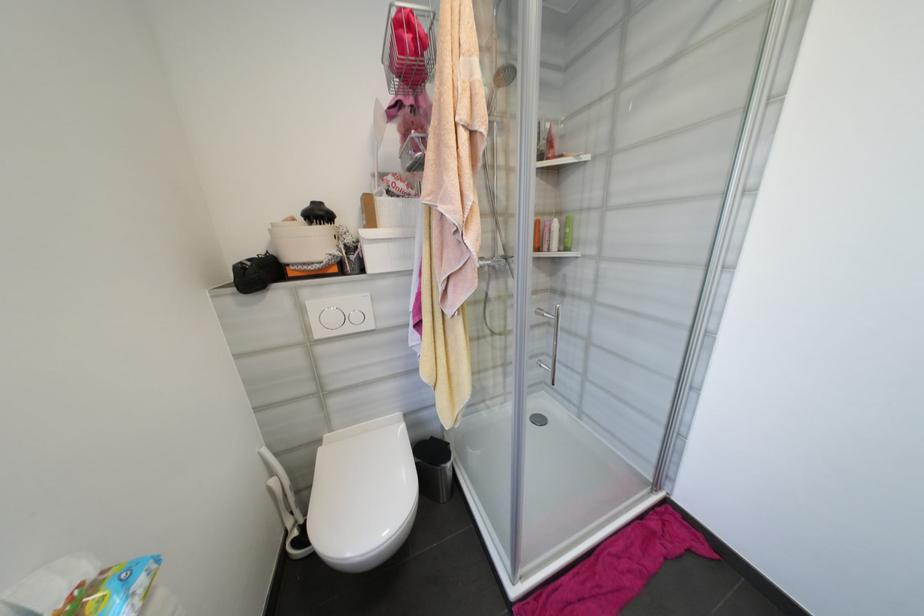
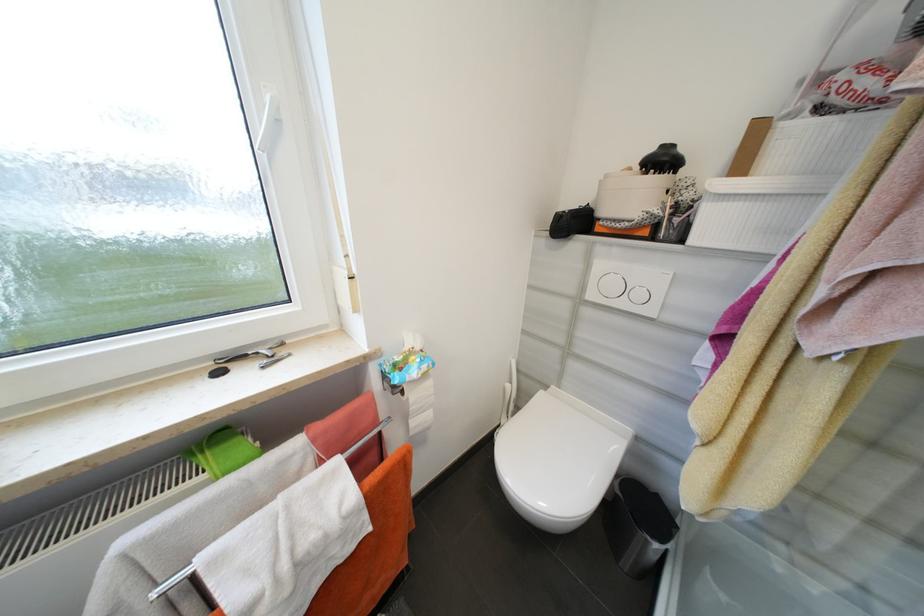
In the second image, find the point that corresponds to point (247, 270) in the first image.

(565, 217)